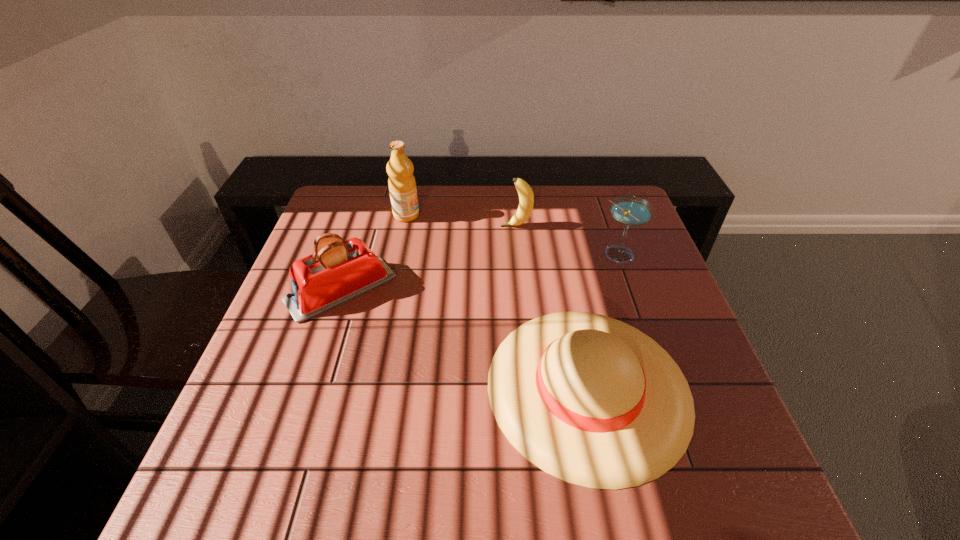
Locate an element on the screen. free space located on the front of the toaster is located at coordinates (282, 467).

Identify the location of vacant space situated 0.050m on the left of the shortest object. (464, 387).

The height and width of the screenshot is (540, 960). In order to click on fruit juice that is at the far edge in this screenshot , I will do `click(402, 186)`.

At what (x,y) coordinates should I click in order to perform the action: click on banana present at the far edge. Please return your answer as a coordinate pair (x, y). Looking at the image, I should click on (526, 197).

In order to click on object that is positioned at the near edge in this screenshot , I will do `click(589, 399)`.

I want to click on object at the left edge, so click(x=338, y=271).

Find the location of `martini present at the right edge`. martini present at the right edge is located at coordinates (631, 211).

The width and height of the screenshot is (960, 540). I want to click on sombrero located at the right edge, so click(x=589, y=399).

In order to click on object that is at the near right corner in this screenshot , I will do `click(589, 399)`.

This screenshot has width=960, height=540. Identify the location of free spot at the far edge of the desktop. (434, 226).